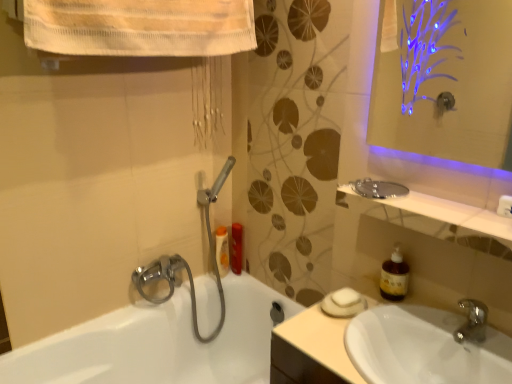
Question: Does white glossy sink at lower right come behind matte plastic bottle at center, the first toiletry when ordered from right to left?

Choices:
 (A) no
 (B) yes

Answer: (A)

Question: Is matte plastic bottle at center, the first toiletry when ordered from right to left, inside white glossy sink at lower right?

Choices:
 (A) no
 (B) yes

Answer: (A)

Question: Is white glossy sink at lower right to the left of matte plastic bottle at center, marked as the second toiletry in a left-to-right arrangement, from the viewer's perspective?

Choices:
 (A) yes
 (B) no

Answer: (B)

Question: From the image's perspective, is white glossy sink at lower right on top of matte plastic bottle at center, the first toiletry when ordered from right to left?

Choices:
 (A) no
 (B) yes

Answer: (A)

Question: Could you tell me if white glossy sink at lower right is turned towards matte plastic bottle at center, marked as the second toiletry in a left-to-right arrangement?

Choices:
 (A) no
 (B) yes

Answer: (A)

Question: Is white glossy sink at lower right outside matte plastic bottle at center, the first toiletry when ordered from right to left?

Choices:
 (A) no
 (B) yes

Answer: (B)

Question: Is brown translucent soap dispenser at right behind white glossy bathtub at lower left?

Choices:
 (A) no
 (B) yes

Answer: (B)

Question: Is brown translucent soap dispenser at right oriented towards white glossy bathtub at lower left?

Choices:
 (A) yes
 (B) no

Answer: (B)

Question: Is brown translucent soap dispenser at right closer to camera compared to white glossy bathtub at lower left?

Choices:
 (A) yes
 (B) no

Answer: (B)

Question: From the image's perspective, does brown translucent soap dispenser at right appear lower than white glossy bathtub at lower left?

Choices:
 (A) yes
 (B) no

Answer: (B)

Question: Is brown translucent soap dispenser at right next to white glossy bathtub at lower left and touching it?

Choices:
 (A) yes
 (B) no

Answer: (B)

Question: Considering the relative positions of brown translucent soap dispenser at right and white glossy bathtub at lower left in the image provided, is brown translucent soap dispenser at right to the right of white glossy bathtub at lower left from the viewer's perspective?

Choices:
 (A) no
 (B) yes

Answer: (B)

Question: Considering the relative sizes of brown translucent soap dispenser at right and matte plastic bottle at center, the first toiletry when ordered from right to left, in the image provided, is brown translucent soap dispenser at right taller than matte plastic bottle at center, the first toiletry when ordered from right to left,?

Choices:
 (A) yes
 (B) no

Answer: (B)